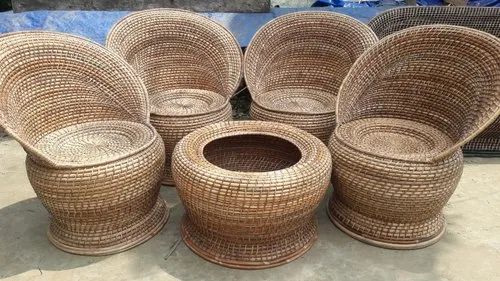
The height and width of the screenshot is (281, 500). What are the coordinates of `leftmost chair back` in the screenshot? It's located at (41, 83).